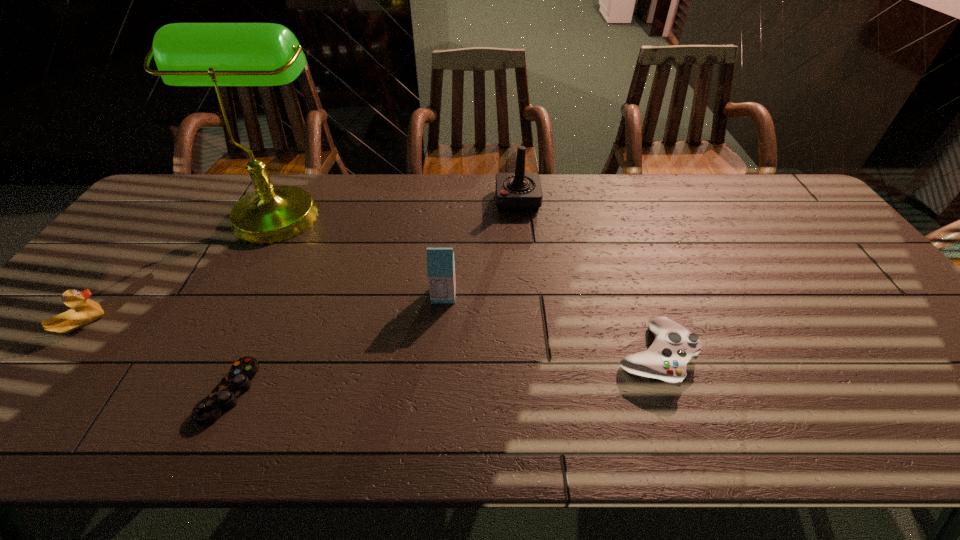
I want to click on joystick at the far edge, so click(x=515, y=192).

At what (x,y) coordinates should I click in order to perform the action: click on object that is at the near edge. Please return your answer as a coordinate pair (x, y). The image size is (960, 540). Looking at the image, I should click on (224, 396).

Find the location of a particular element. This screenshot has width=960, height=540. object that is positioned at the left edge is located at coordinates (83, 311).

The width and height of the screenshot is (960, 540). I want to click on vacant position at the far edge of the desktop, so click(703, 206).

The width and height of the screenshot is (960, 540). In order to click on vacant area at the near edge of the desktop in this screenshot , I will do [x=62, y=427].

In the image, there is a desktop. At what (x,y) coordinates should I click in order to perform the action: click on free space at the near left corner. Please return your answer as a coordinate pair (x, y). Image resolution: width=960 pixels, height=540 pixels. Looking at the image, I should click on (7, 430).

Find the location of `vacant space at the far right corner`. vacant space at the far right corner is located at coordinates (780, 190).

You are a GUI agent. You are given a task and a screenshot of the screen. Output one action in this format:
    pyautogui.click(x=<x>, y=<y>)
    Task: Click on the free space between the shorter control and the leftmost object
    
    Given the screenshot: What is the action you would take?
    pyautogui.click(x=156, y=358)

You are a GUI agent. You are given a task and a screenshot of the screen. Output one action in this format:
    pyautogui.click(x=<x>, y=<y>)
    Task: Click on the vacant area that lies between the shortest object and the second tallest object
    
    Given the screenshot: What is the action you would take?
    pyautogui.click(x=373, y=296)

The width and height of the screenshot is (960, 540). In order to click on free space between the tallest object and the third object from right to left in this screenshot , I will do `click(362, 253)`.